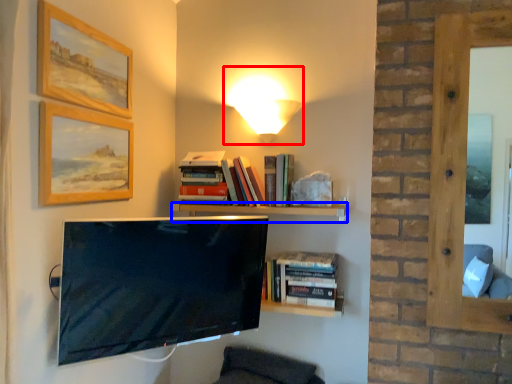
Question: Which point is further to the camera, table lamp (highlighted by a red box) or shelf (highlighted by a blue box)?

Choices:
 (A) table lamp
 (B) shelf

Answer: (A)